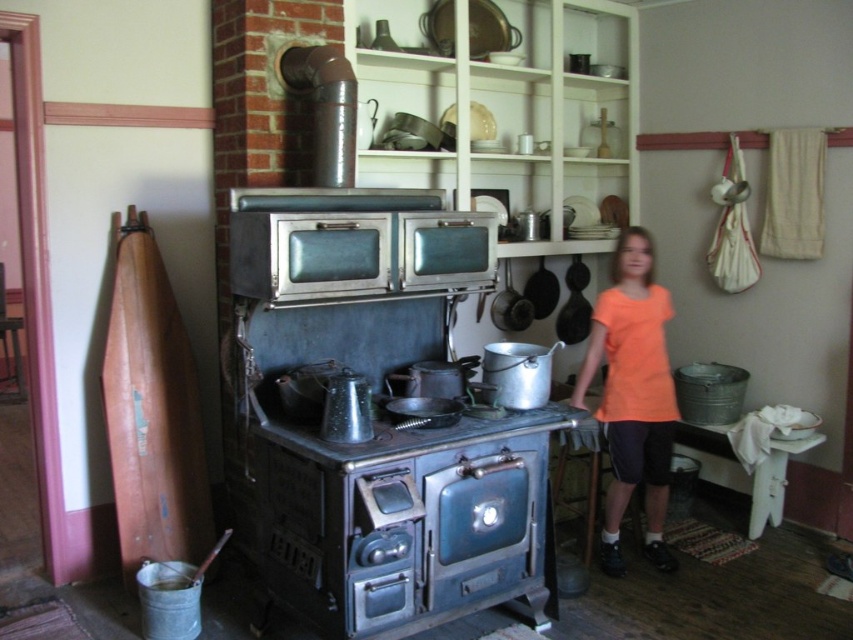
Question: Where is orange t-shirt at right located in relation to blue cast iron stove at center in the image?

Choices:
 (A) left
 (B) right

Answer: (B)

Question: Which object is closer to the camera taking this photo?

Choices:
 (A) orange t-shirt at right
 (B) blue cast iron stove at center

Answer: (B)

Question: Does orange t-shirt at right appear over blue cast iron stove at center?

Choices:
 (A) no
 (B) yes

Answer: (B)

Question: Which object appears farthest from the camera in this image?

Choices:
 (A) orange t-shirt at right
 (B) blue cast iron stove at center

Answer: (A)

Question: Is orange t-shirt at right above blue cast iron stove at center?

Choices:
 (A) no
 (B) yes

Answer: (B)